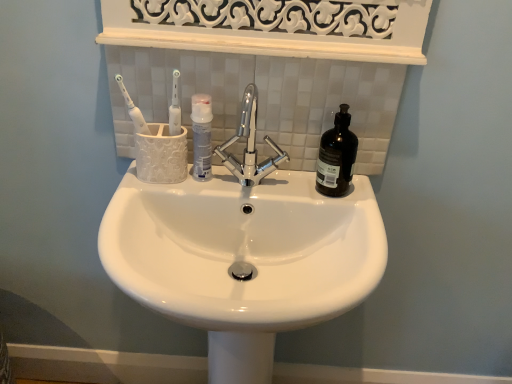
Find the location of a particular element. Image resolution: width=512 pixels, height=384 pixels. free point to the right of white glossy toothbrush at upper left is located at coordinates (218, 177).